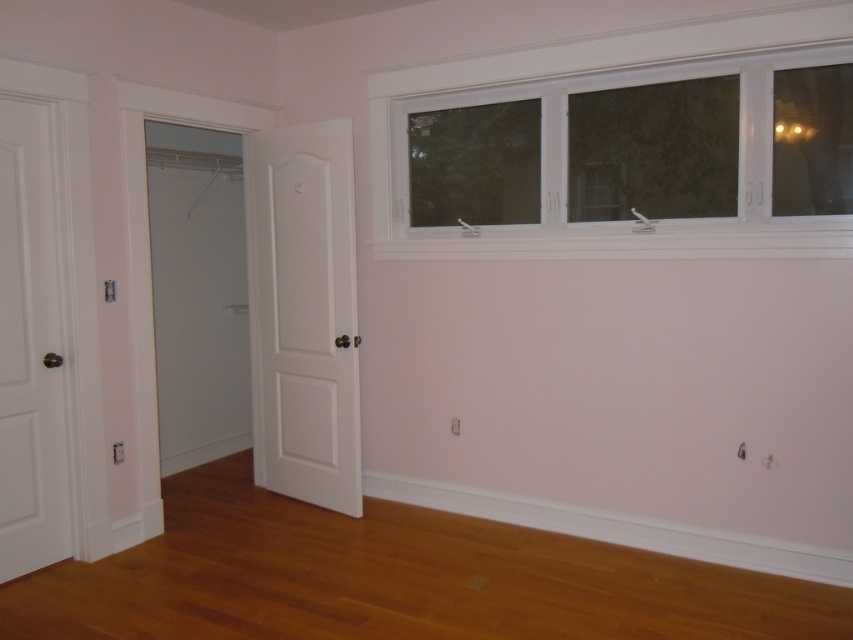
You are standing in the room and want to open the white matte door at center and the white matte door at left. Which door should you open first if you want to exit the room?

The white matte door at left is the correct exit because the white matte door at center is positioned over it, indicating it might be a closet door and not the main exit.

You are standing in the room and want to let more natural light into the space. Which object, the white plastic window at upper right or the white matte door at left, should you open to achieve this?

The white plastic window at upper right is larger in size than the white matte door at left, so opening the white plastic window at upper right would allow more natural light into the room.

You are moving a large painting that is 1.2 meters wide. You want to place it on the wall between the white matte door at center and the white matte door at left. Can the painting fit in the space between them?

The white matte door at center is wider than the white matte door at left. However, the description does not provide the exact distance between them, so we cannot determine if the painting will fit. Additional measurements are needed.